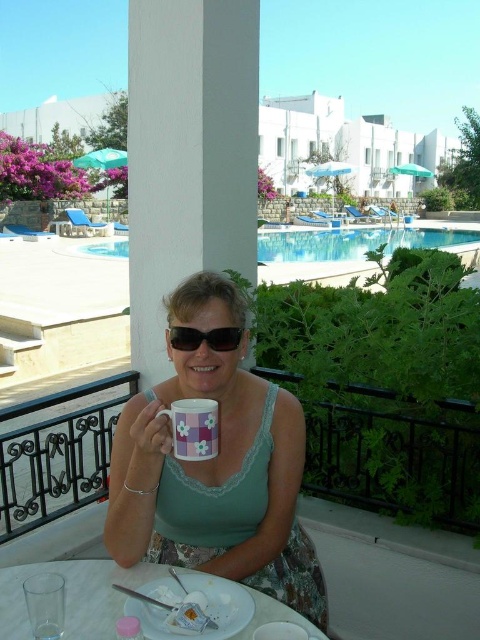
Does pastel floral mug at center come behind transparent plastic cup at lower left?

Yes, it is behind transparent plastic cup at lower left.

Does pastel floral mug at center appear over transparent plastic cup at lower left?

Yes.

Consider the image. Who is more forward, (192, 445) or (48, 621)?

Point (48, 621) is in front.

The image size is (480, 640). Find the location of `pastel floral mug at center`. pastel floral mug at center is located at coordinates (193, 428).

Find the location of `pink floral mug at center`. pink floral mug at center is located at coordinates (216, 467).

Who is higher up, pink floral mug at center or pastel floral mug at center?

Positioned higher is pastel floral mug at center.

Is point (195, 376) closer to camera compared to point (188, 433)?

No, (195, 376) is further to viewer.

This screenshot has width=480, height=640. I want to click on pink floral mug at center, so click(x=216, y=467).

Is white smooth pillar at center thinner than transparent plastic cup at lower left?

Incorrect, white smooth pillar at center's width is not less than transparent plastic cup at lower left's.

Does point (160, 234) lie in front of point (48, 637)?

That is False.

At what (x,y) coordinates should I click in order to perform the action: click on white smooth pillar at center. Please return your answer as a coordinate pair (x, y). Image resolution: width=480 pixels, height=640 pixels. Looking at the image, I should click on (x=188, y=154).